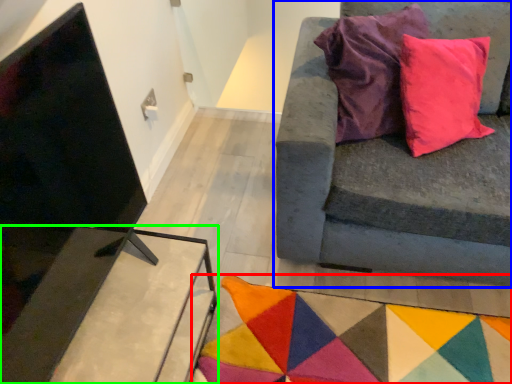
Question: Based on their relative distances, which object is nearer to mat (highlighted by a red box)? Choose from studio couch (highlighted by a blue box) and table (highlighted by a green box).

Choices:
 (A) studio couch
 (B) table

Answer: (A)